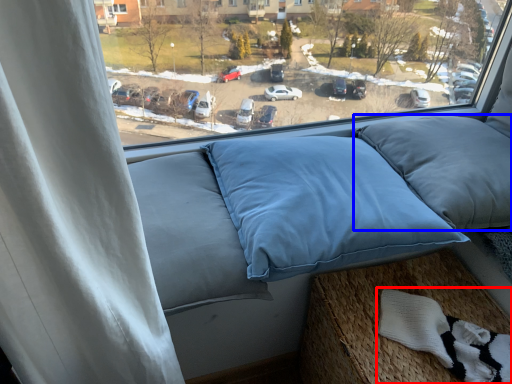
Question: Which of the following is the closest to the observer, material (highlighted by a red box) or pillow (highlighted by a blue box)?

Choices:
 (A) material
 (B) pillow

Answer: (A)